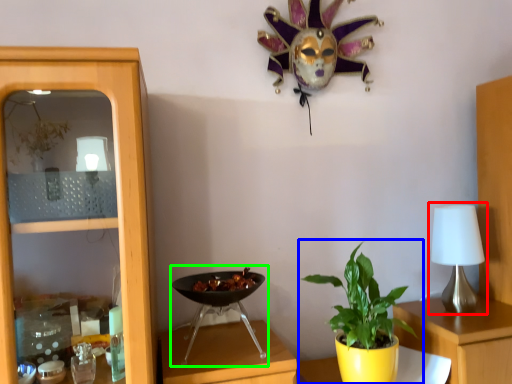
Question: Which object is the farthest from table lamp (highlighted by a red box)? Choose among these: houseplant (highlighted by a blue box) or wok (highlighted by a green box).

Choices:
 (A) houseplant
 (B) wok

Answer: (B)